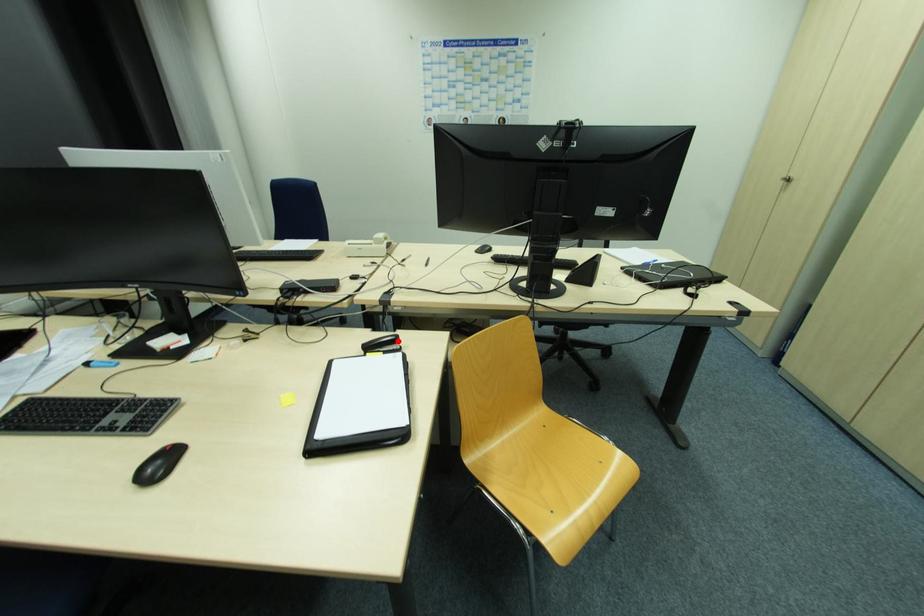
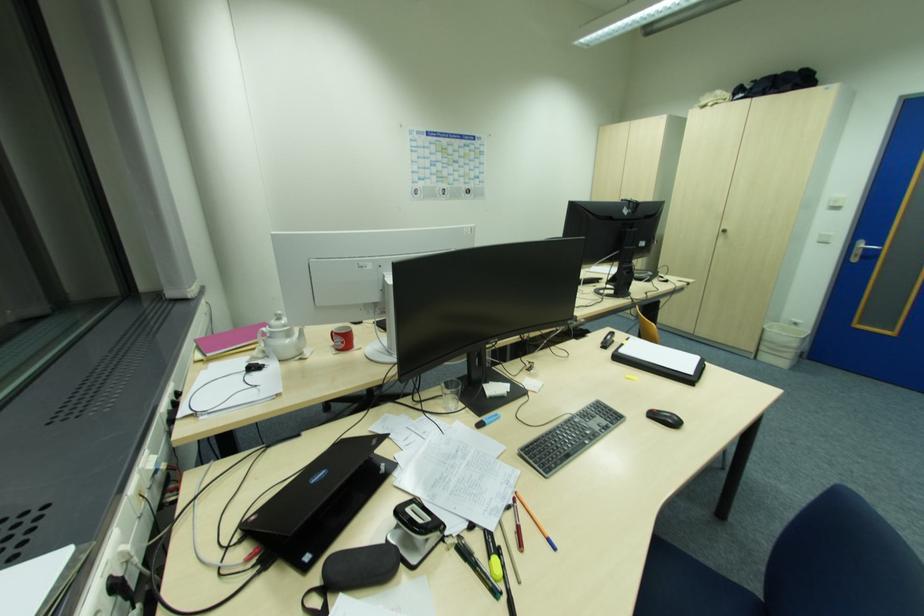
Locate, in the second image, the point that corresponds to the highlighted location in the first image.

(614, 336)